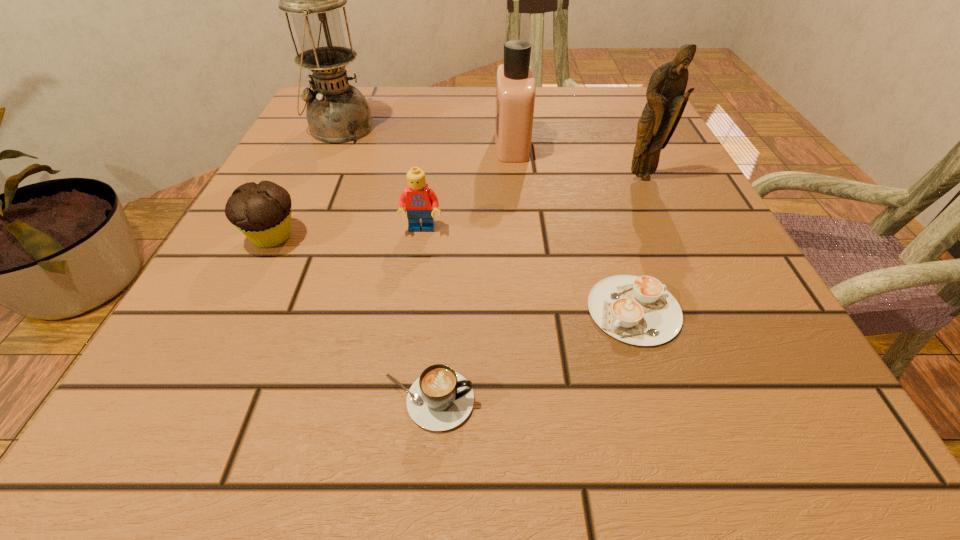
The width and height of the screenshot is (960, 540). In order to click on oil lamp positioned at the far edge in this screenshot , I will do `click(337, 112)`.

At what (x,y) coordinates should I click in order to perform the action: click on perfume that is at the far edge. Please return your answer as a coordinate pair (x, y). This screenshot has width=960, height=540. Looking at the image, I should click on (515, 83).

Where is `object that is at the near edge`? object that is at the near edge is located at coordinates (440, 399).

Locate an element on the screen. oil lamp located in the left edge section of the desktop is located at coordinates (337, 112).

Where is `muffin present at the left edge`? This screenshot has height=540, width=960. muffin present at the left edge is located at coordinates (262, 212).

Locate an element on the screen. The image size is (960, 540). figurine present at the right edge is located at coordinates (666, 99).

Where is `cappuccino that is positioned at the right edge`? The image size is (960, 540). cappuccino that is positioned at the right edge is located at coordinates (640, 311).

Find the location of `object present at the far left corner`. object present at the far left corner is located at coordinates (337, 112).

In the image, there is a desktop. In order to click on vacant area at the far edge in this screenshot , I will do 481,127.

The height and width of the screenshot is (540, 960). In the image, there is a desktop. In order to click on free region at the near edge in this screenshot , I will do `click(617, 414)`.